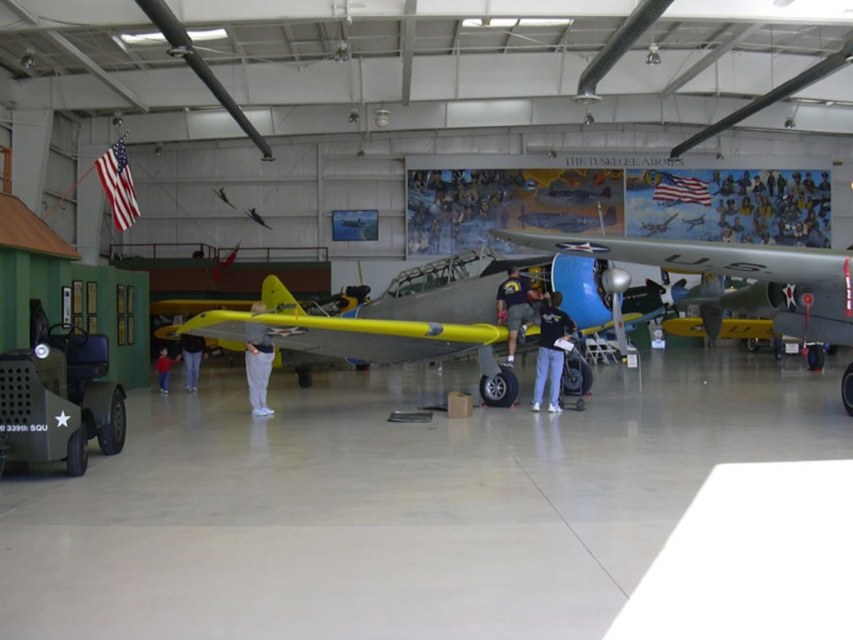
Question: In this image, where is matte silver airplane at center located relative to matte yellow airplane at center?

Choices:
 (A) above
 (B) below

Answer: (A)

Question: Which is farther from the matte silver airplane at center?

Choices:
 (A) yellow matte airplane at center
 (B) light gray pants at center
 (C) dark blue jeans at center
 (D) matte yellow airplane at center

Answer: (B)

Question: Which point is closer to the camera?

Choices:
 (A) (505, 362)
 (B) (164, 353)
 (C) (378, 301)

Answer: (A)

Question: Is dark blue jeans at center further to the viewer compared to red cotton shirt at lower left?

Choices:
 (A) yes
 (B) no

Answer: (B)

Question: Among these objects, which one is nearest to the camera?

Choices:
 (A) dark blue jeans at center
 (B) light gray pants at center
 (C) gray fabric pants at center
 (D) matte silver airplane at center

Answer: (C)

Question: Is the position of matte yellow airplane at center more distant than that of red cotton shirt at lower left?

Choices:
 (A) no
 (B) yes

Answer: (A)